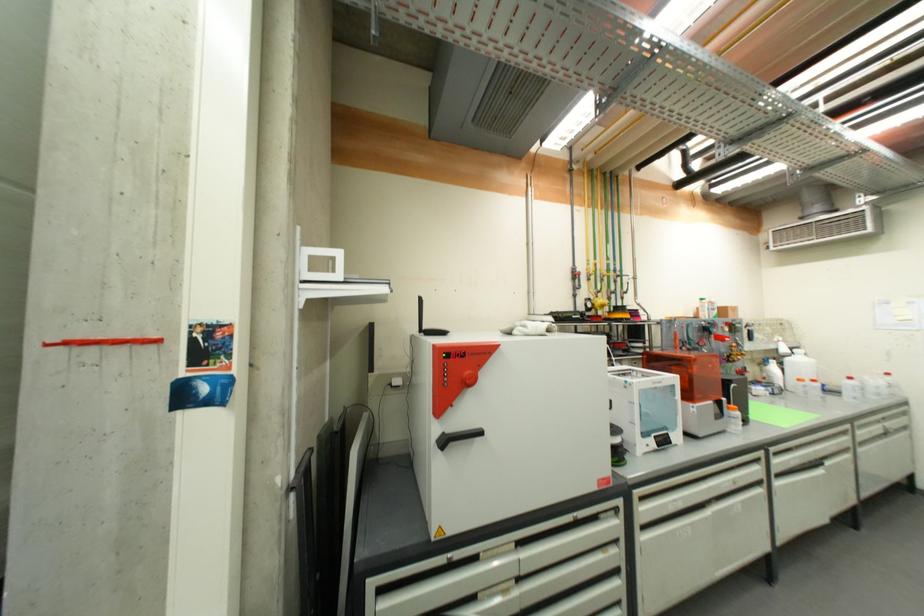
At what (x,y) coordinates should I click in order to perform the action: click on red control dial. Please return your answer as a coordinate pair (x, y). Looking at the image, I should click on (468, 379).